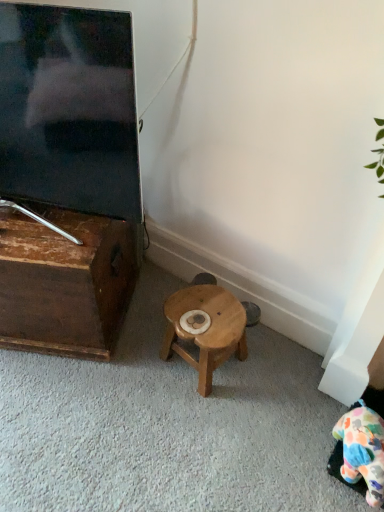
Question: From a real-world perspective, is fluffy multicolored plush at lower right on top of wooden table at left?

Choices:
 (A) no
 (B) yes

Answer: (A)

Question: Is fluffy multicolored plush at lower right to the right of wooden table at left from the viewer's perspective?

Choices:
 (A) no
 (B) yes

Answer: (B)

Question: Is fluffy multicolored plush at lower right thinner than wooden table at left?

Choices:
 (A) no
 (B) yes

Answer: (B)

Question: Does fluffy multicolored plush at lower right have a greater height compared to wooden table at left?

Choices:
 (A) no
 (B) yes

Answer: (A)

Question: Is wooden table at left surrounded by fluffy multicolored plush at lower right?

Choices:
 (A) no
 (B) yes

Answer: (A)

Question: Considering the relative sizes of fluffy multicolored plush at lower right and wooden table at left in the image provided, is fluffy multicolored plush at lower right bigger than wooden table at left?

Choices:
 (A) no
 (B) yes

Answer: (A)

Question: Is wooden table at left oriented away from wooden stool at center?

Choices:
 (A) yes
 (B) no

Answer: (B)

Question: Is wooden table at left located outside wooden stool at center?

Choices:
 (A) no
 (B) yes

Answer: (B)

Question: From the image's perspective, is wooden table at left under wooden stool at center?

Choices:
 (A) yes
 (B) no

Answer: (B)

Question: Can you confirm if wooden table at left is taller than wooden stool at center?

Choices:
 (A) yes
 (B) no

Answer: (A)

Question: Considering the relative positions of wooden table at left and wooden stool at center in the image provided, is wooden table at left to the left of wooden stool at center from the viewer's perspective?

Choices:
 (A) no
 (B) yes

Answer: (B)

Question: Does wooden table at left have a lesser height compared to wooden stool at center?

Choices:
 (A) no
 (B) yes

Answer: (A)

Question: Would you say wooden table at left is a long distance from matte black tv at left?

Choices:
 (A) yes
 (B) no

Answer: (B)